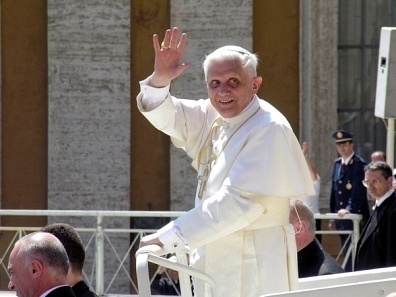
The width and height of the screenshot is (396, 297). I want to click on window, so click(352, 45), click(350, 90), click(372, 22), click(372, 74).